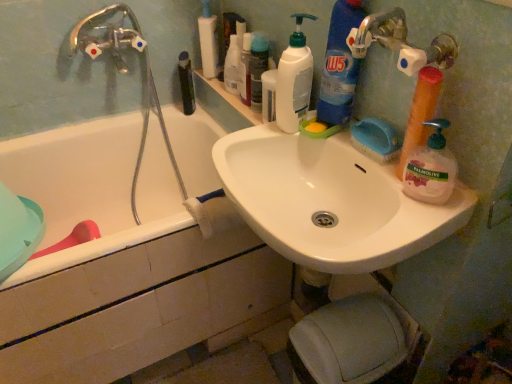
Question: From a real-world perspective, is translucent orange sponge at right, which is the third cleaning product from left to right, physically below white plastic pump bottle at upper center, the first toiletry from the left?

Choices:
 (A) no
 (B) yes

Answer: (A)

Question: From the image's perspective, is translucent orange sponge at right, placed as the second cleaning product when sorted from right to left, on white plastic pump bottle at upper center, the 3th toiletry viewed from the right?

Choices:
 (A) yes
 (B) no

Answer: (B)

Question: Can you confirm if translucent orange sponge at right, which is the third cleaning product from left to right, is smaller than white plastic pump bottle at upper center, the 3th toiletry viewed from the right?

Choices:
 (A) no
 (B) yes

Answer: (B)

Question: Is translucent orange sponge at right, placed as the second cleaning product when sorted from right to left, far away from white plastic pump bottle at upper center, the 3th toiletry viewed from the right?

Choices:
 (A) no
 (B) yes

Answer: (A)

Question: From the image's perspective, is translucent orange sponge at right, which is the third cleaning product from left to right, below white plastic pump bottle at upper center, the first toiletry from the left?

Choices:
 (A) yes
 (B) no

Answer: (A)

Question: Based on their positions, is white ceramic bathtub at left located to the left or right of white plastic bottle at upper center, which ranks as the first cleaning product in left-to-right order?

Choices:
 (A) right
 (B) left

Answer: (B)

Question: Is white ceramic bathtub at left spatially inside white plastic bottle at upper center, which is the 4th cleaning product in right-to-left order, or outside of it?

Choices:
 (A) inside
 (B) outside

Answer: (B)

Question: From a real-world perspective, is white ceramic bathtub at left above or below white plastic bottle at upper center, which is the 4th cleaning product in right-to-left order?

Choices:
 (A) above
 (B) below

Answer: (B)

Question: Is white ceramic bathtub at left taller or shorter than white plastic bottle at upper center, which is the 4th cleaning product in right-to-left order?

Choices:
 (A) short
 (B) tall

Answer: (B)

Question: Relative to white plastic pump bottle at upper center, the first toiletry from the left, is blue glossy detergent at upper right, which ranks as the third cleaning product in right-to-left order, in front or behind?

Choices:
 (A) behind
 (B) front

Answer: (B)

Question: Is blue glossy detergent at upper right, which ranks as the third cleaning product in right-to-left order, taller or shorter than white plastic pump bottle at upper center, the first toiletry from the left?

Choices:
 (A) short
 (B) tall

Answer: (B)

Question: Would you say blue glossy detergent at upper right, positioned as the 2th cleaning product in left-to-right order, is to the left or to the right of white plastic pump bottle at upper center, the 3th toiletry viewed from the right, in the picture?

Choices:
 (A) right
 (B) left

Answer: (A)

Question: From a real-world perspective, relative to white plastic pump bottle at upper center, the first toiletry from the left, is blue glossy detergent at upper right, which ranks as the third cleaning product in right-to-left order, vertically above or below?

Choices:
 (A) below
 (B) above

Answer: (B)

Question: Is white glossy sink at upper center situated inside palmolive liquid soap at right, the first cleaning product viewed from the right, or outside?

Choices:
 (A) outside
 (B) inside

Answer: (A)

Question: Would you say white glossy sink at upper center is to the left or to the right of palmolive liquid soap at right, which appears as the fourth cleaning product when viewed from the left, in the picture?

Choices:
 (A) right
 (B) left

Answer: (B)